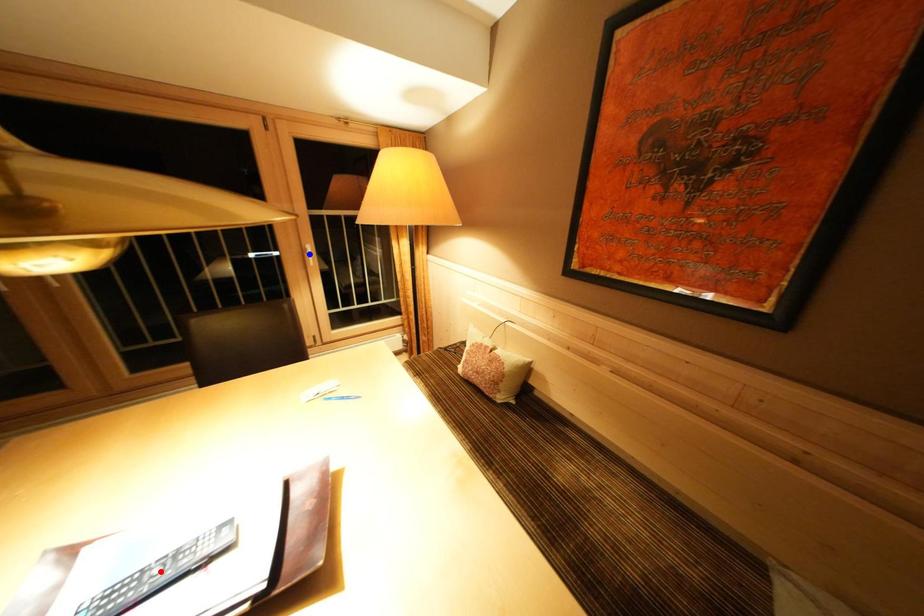
Question: Two points are marked on the image. Which point is closer to the camera?

Choices:
 (A) Blue point is closer.
 (B) Red point is closer.

Answer: (B)